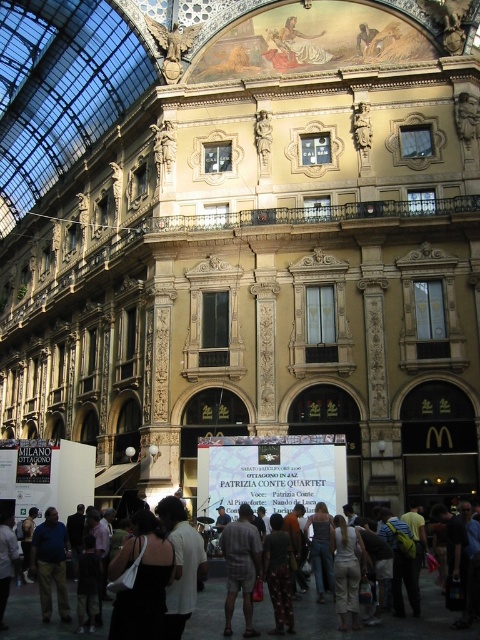
You are a customer in this historic shopping arcade and you see a mannequin wearing a white cotton shirt at center and light brown fabric shorts at center. Which clothing item is positioned higher on the mannequin?

The white cotton shirt at center is positioned higher than the light brown fabric shorts at center on the mannequin.

You are standing in the grand building and want to move from the point at coordinates point (132, 538) to the point at coordinates point (181, 557). Which direction should you move to reach your destination?

Since point (132, 538) is behind point (181, 557), you should move forward to reach the destination.

Looking at this image, you are a customer in this grand building and want to pick up both the white cotton shirt at center and the light brown fabric shorts at center from the same display stand. Which item would you reach for first to grab both efficiently?

You should reach for the white cotton shirt at center first since it is closer to you than the light brown fabric shorts at center, allowing you to grab both items efficiently without needing to adjust your position.